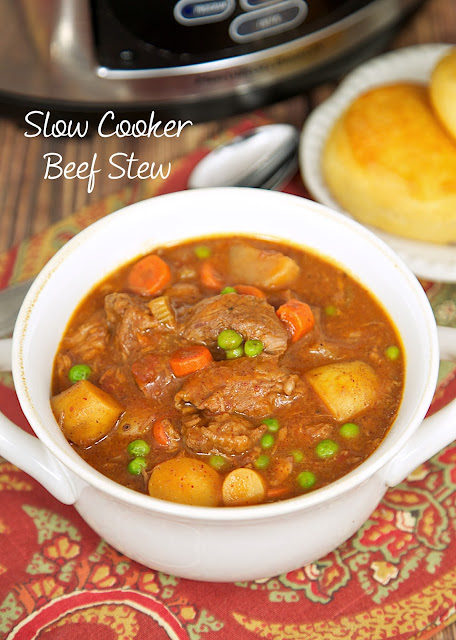
Identify the location of spoon. (255, 155).